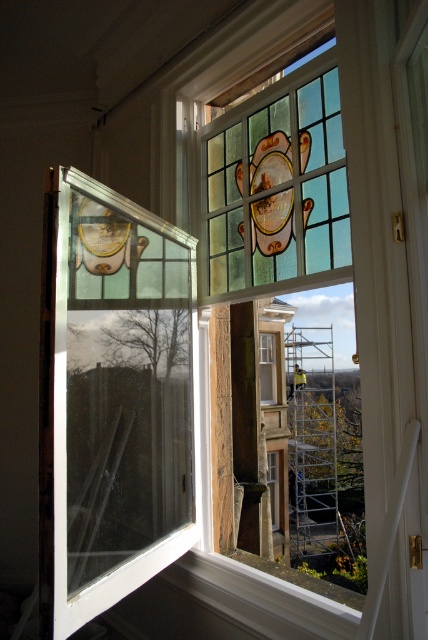
Question: Does stained glass window at center appear on the left side of clear glass window at center?

Choices:
 (A) yes
 (B) no

Answer: (A)

Question: Does silver metallic scaffolding at center have a greater width compared to stained glass window at center?

Choices:
 (A) no
 (B) yes

Answer: (B)

Question: Does stained glass window at center appear under clear glass window at center?

Choices:
 (A) no
 (B) yes

Answer: (A)

Question: Based on their relative distances, which object is farther from the clear glass window at center?

Choices:
 (A) stained glass window at center
 (B) silver metallic scaffolding at center

Answer: (B)

Question: Which point is farther to the camera?

Choices:
 (A) clear glass window at left
 (B) stained glass window at center
 (C) clear glass window at center

Answer: (C)

Question: Among these objects, which one is farthest from the camera?

Choices:
 (A) clear glass window at left
 (B) silver metallic scaffolding at center
 (C) clear glass window at center
 (D) stained glass window at center

Answer: (B)